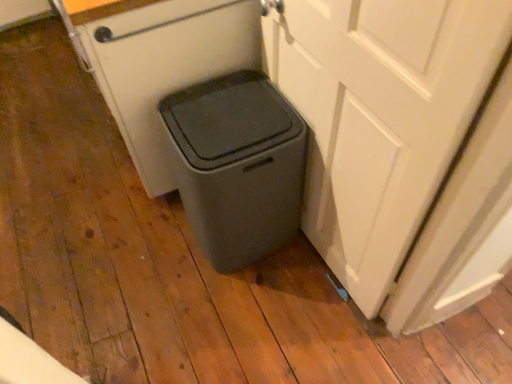
Question: Does matte gray trash can at lower center have a smaller size compared to white matte door at right?

Choices:
 (A) no
 (B) yes

Answer: (A)

Question: From the image's perspective, is matte gray trash can at lower center under white matte door at right?

Choices:
 (A) yes
 (B) no

Answer: (A)

Question: Is matte gray trash can at lower center closer to the viewer compared to white matte door at right?

Choices:
 (A) no
 (B) yes

Answer: (A)

Question: Can you confirm if matte gray trash can at lower center is positioned to the left of white matte door at right?

Choices:
 (A) yes
 (B) no

Answer: (A)

Question: Is white matte door at right at the back of matte gray trash can at lower center?

Choices:
 (A) no
 (B) yes

Answer: (B)

Question: From a real-world perspective, is matte gray trash can at lower center over white matte door at right?

Choices:
 (A) yes
 (B) no

Answer: (B)

Question: Is white matte door at right wider than matte gray trash can at lower center?

Choices:
 (A) yes
 (B) no

Answer: (B)

Question: Is white matte door at right taller than matte gray trash can at lower center?

Choices:
 (A) no
 (B) yes

Answer: (B)

Question: From a real-world perspective, is white matte door at right located higher than matte gray trash can at lower center?

Choices:
 (A) no
 (B) yes

Answer: (B)

Question: Is the depth of white matte door at right greater than that of matte gray trash can at lower center?

Choices:
 (A) no
 (B) yes

Answer: (A)

Question: Is white matte door at right facing towards matte gray trash can at lower center?

Choices:
 (A) yes
 (B) no

Answer: (A)

Question: From the image's perspective, is white matte door at right located above matte gray trash can at lower center?

Choices:
 (A) no
 (B) yes

Answer: (B)

Question: Is matte gray trash can at lower center wider or thinner than white matte door at right?

Choices:
 (A) wide
 (B) thin

Answer: (A)